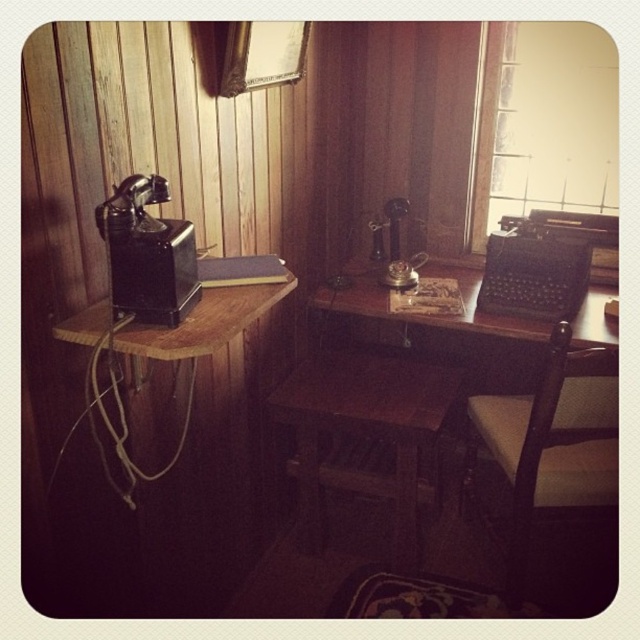
Question: Which of the following is the farthest from the observer?

Choices:
 (A) light brown wooden chair at lower right
 (B) wooden stool at center

Answer: (B)

Question: Does wooden stool at center lie in front of light brown wooden chair at lower right?

Choices:
 (A) no
 (B) yes

Answer: (A)

Question: Which object appears farthest from the camera in this image?

Choices:
 (A) light brown wooden chair at lower right
 (B) wooden stool at center

Answer: (B)

Question: Does wooden stool at center have a lesser width compared to light brown wooden chair at lower right?

Choices:
 (A) yes
 (B) no

Answer: (B)

Question: In this image, where is wooden stool at center located relative to light brown wooden chair at lower right?

Choices:
 (A) right
 (B) left

Answer: (B)